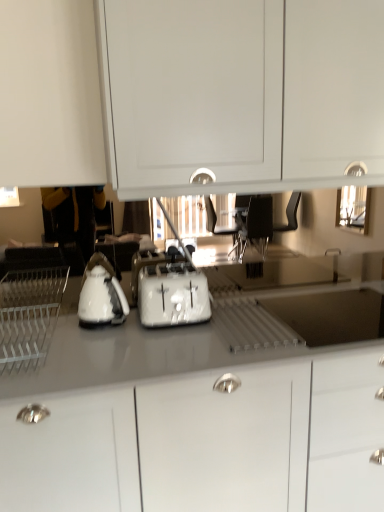
Question: From a real-world perspective, is white glossy cabinet at center, acting as the 2th cabinetry starting from the top, positioned over white glossy electric kettle at center based on gravity?

Choices:
 (A) yes
 (B) no

Answer: (B)

Question: Does white glossy cabinet at center, which ranks as the first cabinetry in bottom-to-top order, contain white glossy electric kettle at center?

Choices:
 (A) yes
 (B) no

Answer: (B)

Question: Is white glossy cabinet at center, which ranks as the first cabinetry in bottom-to-top order, shorter than white glossy electric kettle at center?

Choices:
 (A) no
 (B) yes

Answer: (A)

Question: From the image's perspective, is white glossy cabinet at center, acting as the 2th cabinetry starting from the top, beneath white glossy electric kettle at center?

Choices:
 (A) no
 (B) yes

Answer: (B)

Question: Does white glossy cabinet at center, which ranks as the first cabinetry in bottom-to-top order, have a smaller size compared to white glossy electric kettle at center?

Choices:
 (A) yes
 (B) no

Answer: (B)

Question: From their relative heights in the image, would you say white plastic toaster at center is taller or shorter than white plastic dish rack at left?

Choices:
 (A) short
 (B) tall

Answer: (B)

Question: Based on their positions, is white plastic toaster at center located to the left or right of white plastic dish rack at left?

Choices:
 (A) left
 (B) right

Answer: (B)

Question: From a real-world perspective, relative to white plastic dish rack at left, is white plastic toaster at center vertically above or below?

Choices:
 (A) below
 (B) above

Answer: (B)

Question: Is white plastic toaster at center in front of or behind white plastic dish rack at left in the image?

Choices:
 (A) front
 (B) behind

Answer: (B)

Question: Is white plastic toaster at center bigger or smaller than white glossy cabinet at center, which ranks as the first cabinetry in bottom-to-top order?

Choices:
 (A) small
 (B) big

Answer: (A)

Question: Which is correct: white plastic toaster at center is inside white glossy cabinet at center, which ranks as the first cabinetry in bottom-to-top order, or outside of it?

Choices:
 (A) outside
 (B) inside

Answer: (A)

Question: Relative to white glossy cabinet at center, acting as the 2th cabinetry starting from the top, is white plastic toaster at center in front or behind?

Choices:
 (A) behind
 (B) front

Answer: (A)

Question: Would you say white plastic toaster at center is to the left or to the right of white glossy cabinet at center, acting as the 2th cabinetry starting from the top, in the picture?

Choices:
 (A) right
 (B) left

Answer: (B)

Question: Considering the positions of white matte cabinet at upper center, which is the first cabinetry from top to bottom, and white glossy cabinet at center, which ranks as the first cabinetry in bottom-to-top order, in the image, is white matte cabinet at upper center, which is the first cabinetry from top to bottom, taller or shorter than white glossy cabinet at center, which ranks as the first cabinetry in bottom-to-top order,?

Choices:
 (A) tall
 (B) short

Answer: (B)

Question: Is white matte cabinet at upper center, which appears as the 2th cabinetry when ordered from the bottom, to the left or to the right of white glossy cabinet at center, which ranks as the first cabinetry in bottom-to-top order, in the image?

Choices:
 (A) right
 (B) left

Answer: (A)